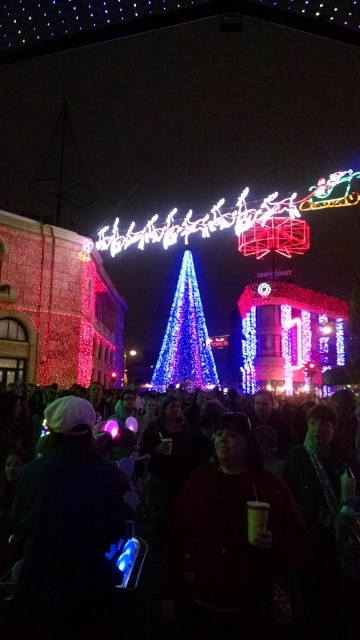
Question: Which of these objects is positioned closest to the black fabric crowd at lower center?

Choices:
 (A) dark matte sweatshirt at center
 (B) blue led lights at center

Answer: (A)

Question: Which of the following is the farthest from the observer?

Choices:
 (A) (290, 508)
 (B) (187, 284)

Answer: (B)

Question: Does dark matte sweatshirt at center appear on the left side of blue led lights at center?

Choices:
 (A) no
 (B) yes

Answer: (A)

Question: Does dark matte sweatshirt at center have a greater width compared to blue led lights at center?

Choices:
 (A) no
 (B) yes

Answer: (B)

Question: Which point is closer to the camera?

Choices:
 (A) (43, 602)
 (B) (189, 602)

Answer: (A)

Question: Is the position of black fabric crowd at lower center more distant than that of dark matte sweatshirt at center?

Choices:
 (A) yes
 (B) no

Answer: (B)